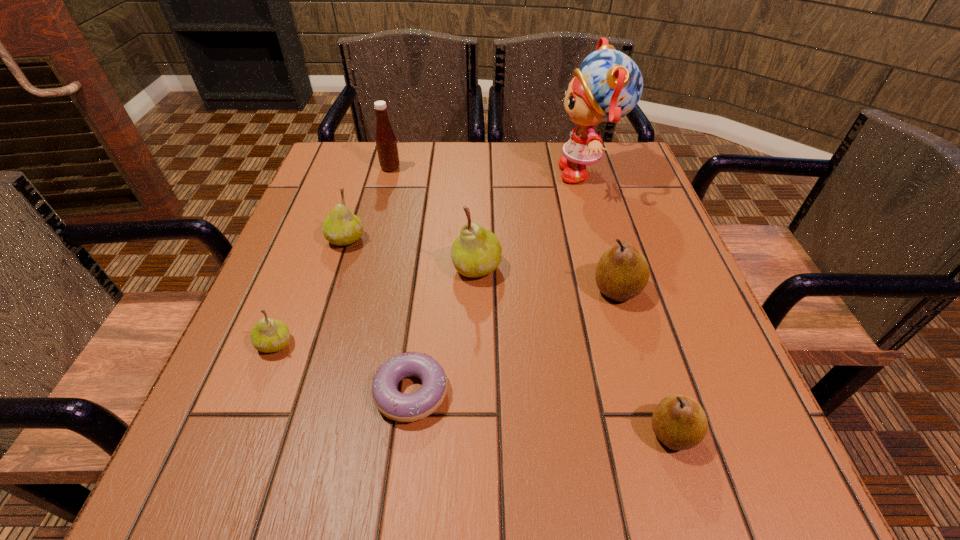
Find the location of a particular element. The width and height of the screenshot is (960, 540). the tallest object is located at coordinates (608, 85).

In order to click on white Tabasco sauce in this screenshot , I will do `click(386, 143)`.

Locate an element on the screen. the biggest green pear is located at coordinates (476, 252).

You are a GUI agent. You are given a task and a screenshot of the screen. Output one action in this format:
    pyautogui.click(x=<x>, y=<y>)
    Task: Click on the rightmost green pear
    The width and height of the screenshot is (960, 540).
    Given the screenshot: What is the action you would take?
    pyautogui.click(x=476, y=252)

You are a GUI agent. You are given a task and a screenshot of the screen. Output one action in this format:
    pyautogui.click(x=<x>, y=<y>)
    Task: Click on the second biggest green pear
    The image size is (960, 540).
    Given the screenshot: What is the action you would take?
    pyautogui.click(x=341, y=227)

Locate an element on the screen. This screenshot has height=540, width=960. the bigger brown pear is located at coordinates (622, 272).

Find the location of a particular element. The width and height of the screenshot is (960, 540). the smallest green pear is located at coordinates (268, 335).

This screenshot has width=960, height=540. I want to click on the fourth farthest pear, so click(x=268, y=335).

At what (x,y) coordinates should I click in order to perform the action: click on the nearer brown pear. Please return your answer as a coordinate pair (x, y). The image size is (960, 540). Looking at the image, I should click on (679, 422).

Where is `the nearest pear`? Image resolution: width=960 pixels, height=540 pixels. the nearest pear is located at coordinates (679, 422).